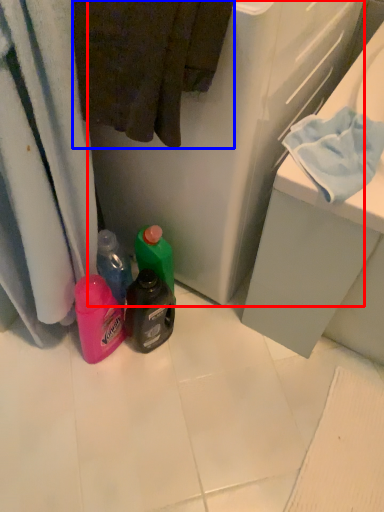
Question: Which point is closer to the camera, appliance (highlighted by a red box) or bath towel (highlighted by a blue box)?

Choices:
 (A) appliance
 (B) bath towel

Answer: (B)